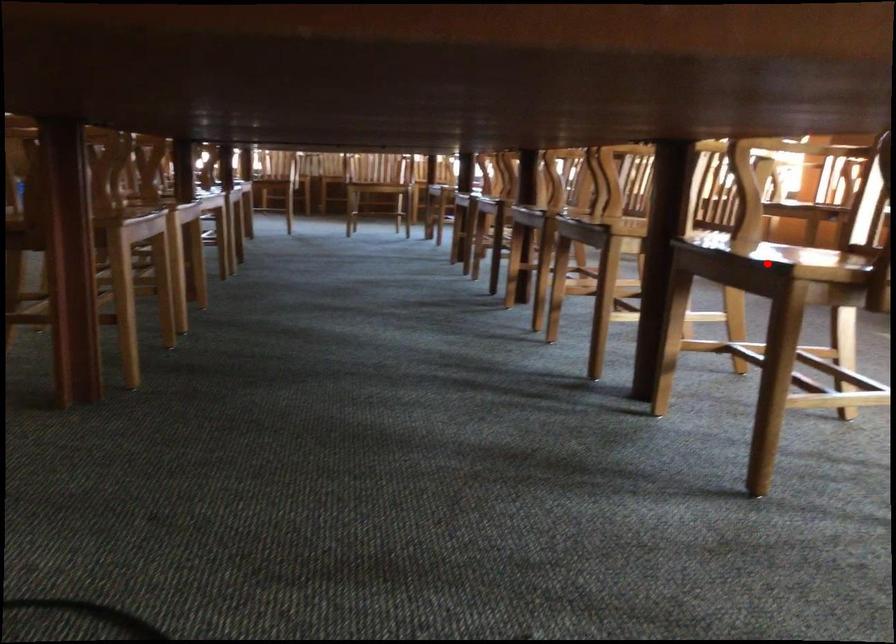
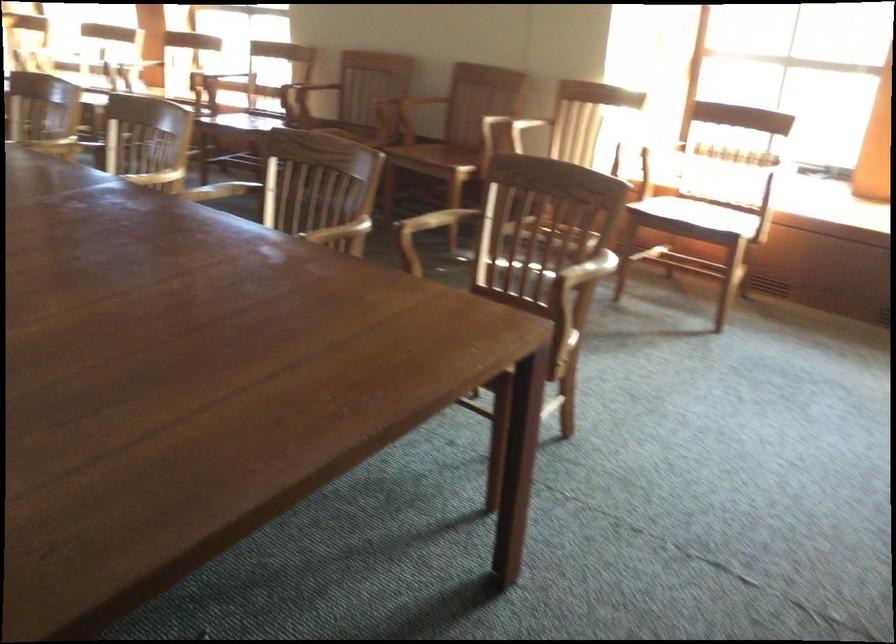
Question: I am providing you with two images of the same scene from different viewpoints. A red point is marked on the first image. Can you still see the location of the red point in image 2?

Choices:
 (A) Yes
 (B) No

Answer: (B)